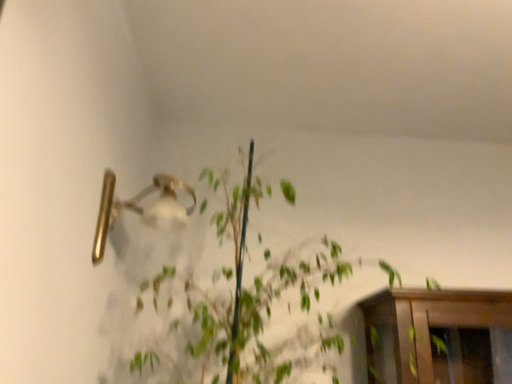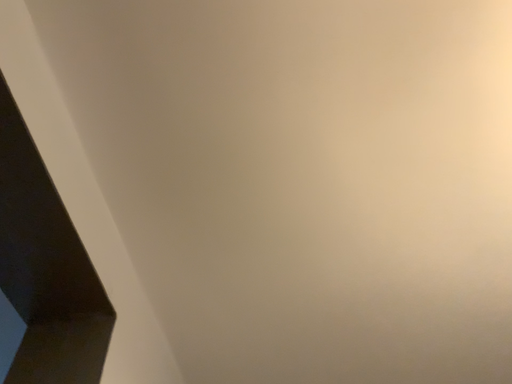
Question: How did the camera likely rotate when shooting the video?

Choices:
 (A) rotated downward
 (B) rotated upward

Answer: (B)